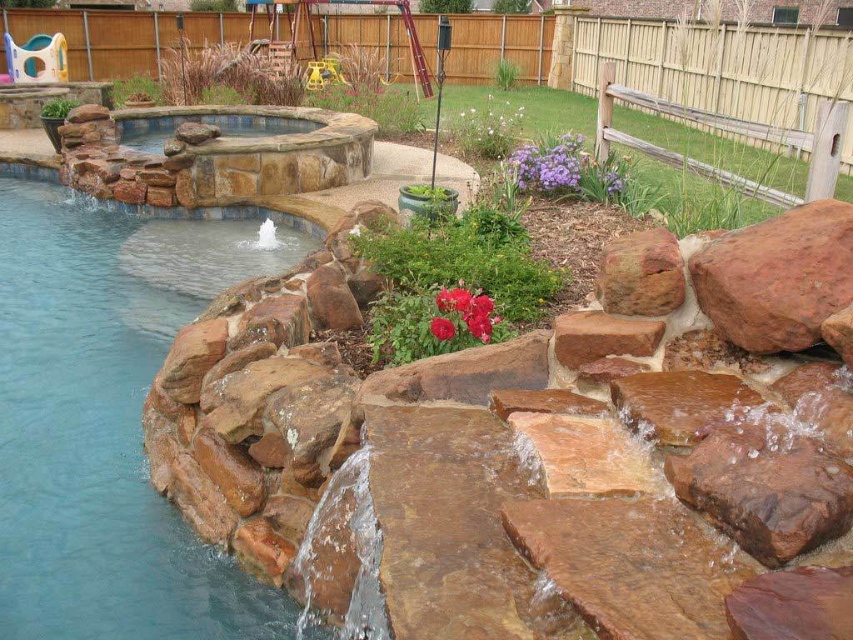
Is brown stone pond at left to the right of red matte flower at center from the viewer's perspective?

Incorrect, brown stone pond at left is not on the right side of red matte flower at center.

What do you see at coordinates (112, 413) in the screenshot? I see `brown stone pond at left` at bounding box center [112, 413].

Does point (155, 605) lie in front of point (439, 321)?

Yes, it is in front of point (439, 321).

Locate an element on the screen. brown stone pond at left is located at coordinates (112, 413).

Is point (799, 260) farther from camera compared to point (457, 298)?

No, (799, 260) is closer to viewer.

Where is `rustic brown rock at right`? rustic brown rock at right is located at coordinates (776, 276).

Find the location of `rustic brown rock at right`. rustic brown rock at right is located at coordinates (776, 276).

Is brown stone pond at left positioned at the back of rustic brown rock at right?

That is True.

How far apart are brown stone pond at left and rustic brown rock at right?

brown stone pond at left and rustic brown rock at right are 4.36 meters apart.

Does point (112, 516) lie behind point (796, 224)?

Yes.

This screenshot has width=853, height=640. Identify the location of brown stone pond at left. (112, 413).